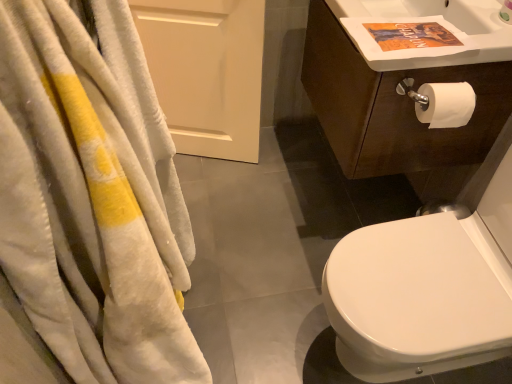
Question: Does dark brown wood cabinet at upper right lie in front of white soft towel at left?

Choices:
 (A) yes
 (B) no

Answer: (B)

Question: Can you confirm if dark brown wood cabinet at upper right is wider than white soft towel at left?

Choices:
 (A) yes
 (B) no

Answer: (A)

Question: Is dark brown wood cabinet at upper right taller than white soft towel at left?

Choices:
 (A) no
 (B) yes

Answer: (A)

Question: From the image's perspective, is dark brown wood cabinet at upper right beneath white soft towel at left?

Choices:
 (A) yes
 (B) no

Answer: (B)

Question: Is white soft towel at left inside dark brown wood cabinet at upper right?

Choices:
 (A) yes
 (B) no

Answer: (B)

Question: Is point (194, 52) closer or farther from the camera than point (397, 306)?

Choices:
 (A) closer
 (B) farther

Answer: (B)

Question: From their relative heights in the image, would you say white matte door at upper left is taller or shorter than white glossy bidet at right?

Choices:
 (A) tall
 (B) short

Answer: (B)

Question: In the image, is white matte door at upper left on the left side or the right side of white glossy bidet at right?

Choices:
 (A) right
 (B) left

Answer: (B)

Question: Considering their positions, is white matte door at upper left located in front of or behind white glossy bidet at right?

Choices:
 (A) front
 (B) behind

Answer: (B)

Question: From the image's perspective, relative to white glossy sink at upper right, is dark brown wood cabinet at upper right above or below?

Choices:
 (A) above
 (B) below

Answer: (A)

Question: Would you say dark brown wood cabinet at upper right is to the left or to the right of white glossy sink at upper right in the picture?

Choices:
 (A) left
 (B) right

Answer: (B)

Question: Is dark brown wood cabinet at upper right spatially inside white glossy sink at upper right, or outside of it?

Choices:
 (A) outside
 (B) inside

Answer: (A)

Question: From a real-world perspective, relative to white glossy sink at upper right, is dark brown wood cabinet at upper right vertically above or below?

Choices:
 (A) above
 (B) below

Answer: (B)

Question: Visually, is dark brown wood cabinet at upper right positioned to the left or to the right of white glossy bidet at right?

Choices:
 (A) left
 (B) right

Answer: (A)

Question: Looking at their shapes, would you say dark brown wood cabinet at upper right is wider or thinner than white glossy bidet at right?

Choices:
 (A) thin
 (B) wide

Answer: (A)